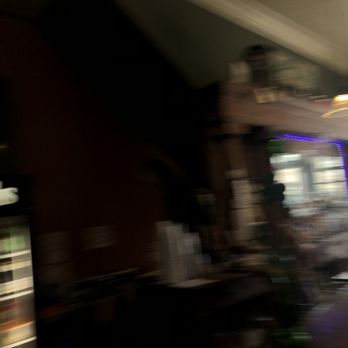
Image resolution: width=348 pixels, height=348 pixels. Identify the location of empty space on wall left of mirror. [x=105, y=98], [x=104, y=94].